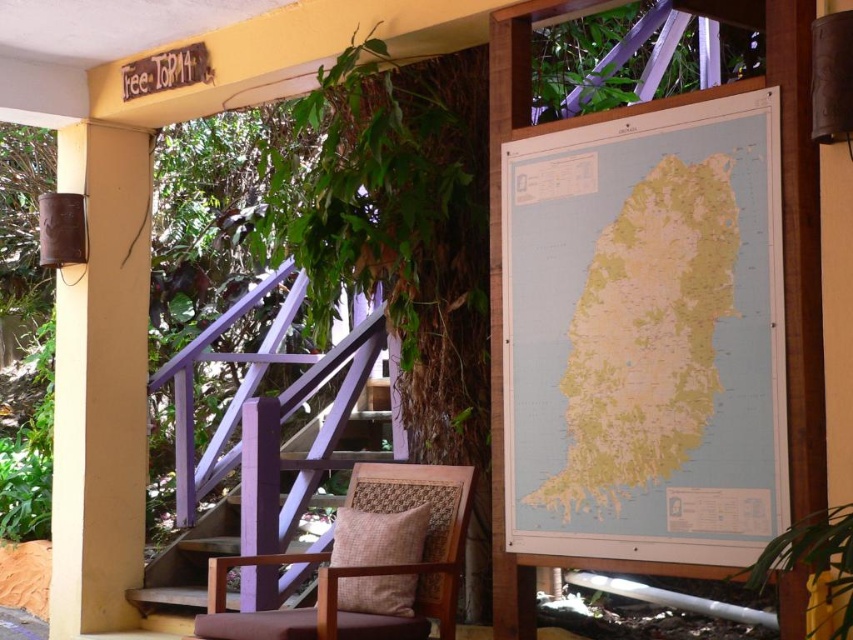
You are standing at the bottom of the purple wood stairs at center and want to sit in the brown woven armchair at center. Which direction should you move to reach it?

You should move upward towards the brown woven armchair at center because the purple wood stairs at center are located below it.

You are a guest at the resort and want to look at the light blue paper map at right. However, the purple wood stairs at center are in your way. Can you move the map without moving the stairs?

The light blue paper map at right is positioned over the purple wood stairs at center, so you can move the map without moving the stairs because it is placed on top of them.